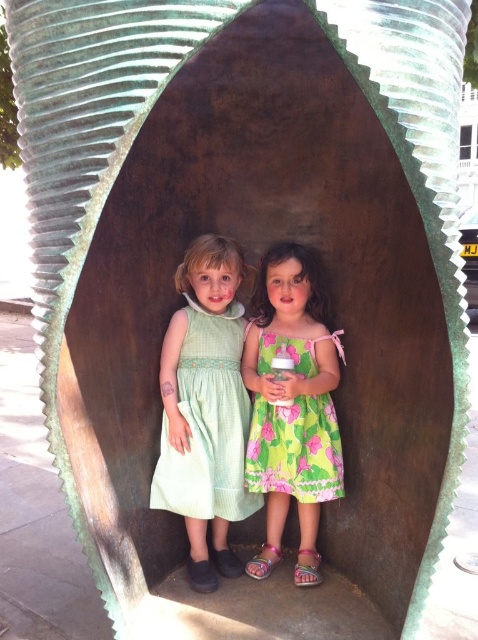
You are a photographer trying to capture the children in the seed pod structure. You need to position your camera at the point with coordinates point [207,422]. What object will be directly in the camera lens at this position?

The point [207,422] corresponds to the green textured dress at center, so the camera lens will directly capture the green textured dress at center.

What are the coordinates of the green textured dress at center in the image?

The green textured dress at center is located at coordinates point (207, 422).

You are a photographer trying to capture a photo of both children in the seed pod structure. Since you want to ensure both dresses are visible in the frame, which direction should you position yourself relative to the children to clearly see both the green textured dress at center and the green floral dress at center?

You should position yourself to the right of the children so that you can clearly see both the green textured dress at center to the left and the green floral dress at center to the right.